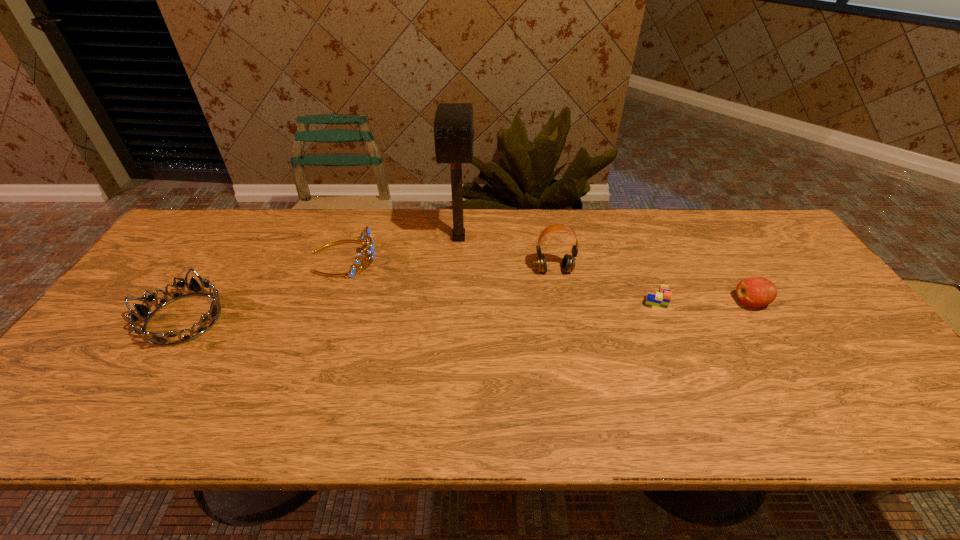
Identify the location of the tallest object. Image resolution: width=960 pixels, height=540 pixels. (453, 125).

The height and width of the screenshot is (540, 960). I want to click on the third object from left to right, so click(453, 125).

Where is `the second tallest object`? the second tallest object is located at coordinates (568, 263).

Identify the location of the third object from right to left. (568, 263).

Where is `the right tiara`? Image resolution: width=960 pixels, height=540 pixels. the right tiara is located at coordinates (365, 236).

Locate an element on the screen. the fifth object from right to left is located at coordinates (365, 236).

This screenshot has height=540, width=960. Identify the location of apple. (756, 292).

Where is `the shorter tiara`? the shorter tiara is located at coordinates (144, 312).

Where is `the leftmost object`? Image resolution: width=960 pixels, height=540 pixels. the leftmost object is located at coordinates (144, 312).

The width and height of the screenshot is (960, 540). What are the coordinates of `Lego` in the screenshot? It's located at (660, 301).